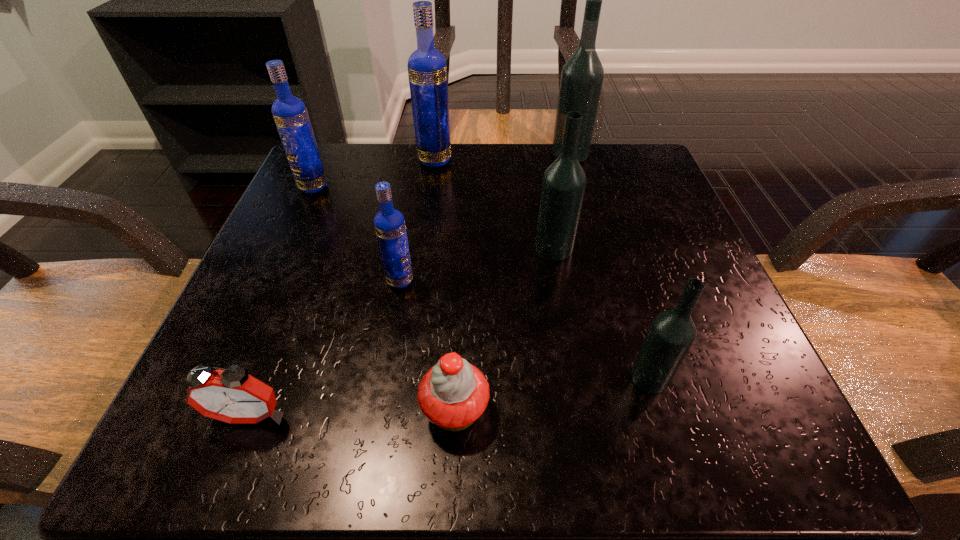
The width and height of the screenshot is (960, 540). In order to click on blank space at the left edge of the desktop in this screenshot , I will do `click(272, 238)`.

Identify the location of free spot at the right edge of the desktop. The width and height of the screenshot is (960, 540). (640, 332).

Locate an element on the screen. free spot at the near left corner of the desktop is located at coordinates (179, 438).

Identify the location of free spot at the far right corner of the desktop. (610, 161).

You are a GUI agent. You are given a task and a screenshot of the screen. Output one action in this format:
    pyautogui.click(x=<x>, y=<y>)
    Task: Click on the vacant point located between the smallest blue vodka and the second biggest blue vodka
    
    Given the screenshot: What is the action you would take?
    pyautogui.click(x=356, y=234)

Image resolution: width=960 pixels, height=540 pixels. I want to click on vacant area that lies between the farthest blue vodka and the biggest black vodka, so click(x=502, y=157).

I want to click on vacant point located between the fourth farthest object and the cupcake, so click(x=504, y=329).

Where is `free space between the leftmost vodka and the farthest blue vodka`? free space between the leftmost vodka and the farthest blue vodka is located at coordinates (374, 173).

The width and height of the screenshot is (960, 540). I want to click on free space between the fifth farthest vodka and the nearest vodka, so click(x=525, y=329).

In order to click on empty space between the second nearest blue vodka and the second smallest black vodka in this screenshot , I will do `click(434, 218)`.